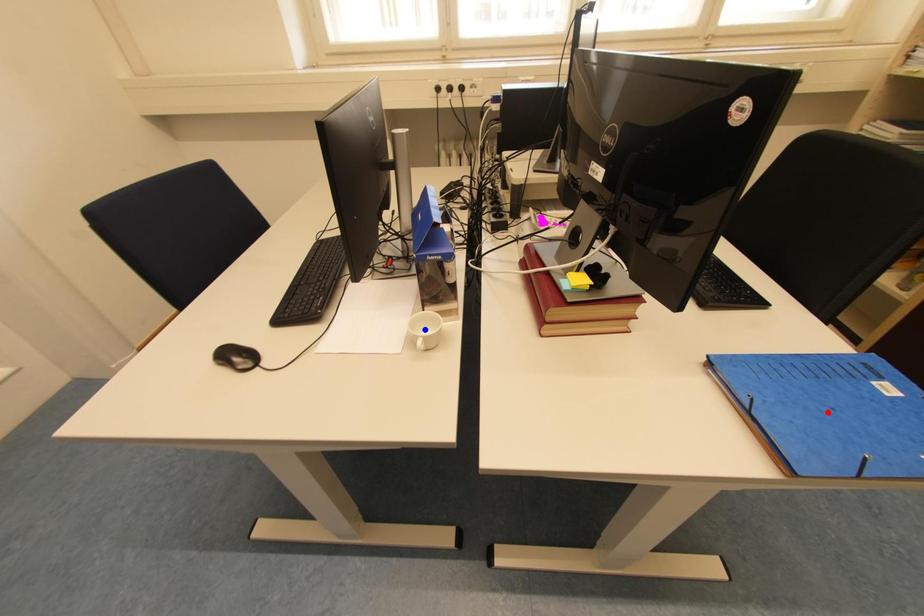
Question: Two points are marked on the image. Which point is closer to the camera?

Choices:
 (A) Blue point is closer.
 (B) Red point is closer.

Answer: (B)